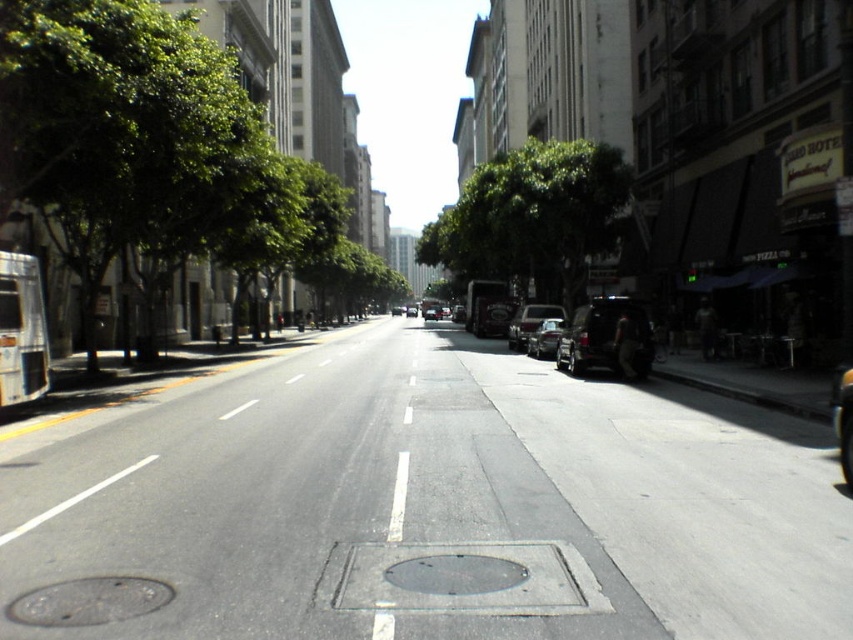
You are standing on the sidewalk of the urban street. You see a green leafy tree at center and a shiny silver car at center. Which object is positioned to the right from your perspective?

The green leafy tree at center is to the right of the shiny silver car at center.